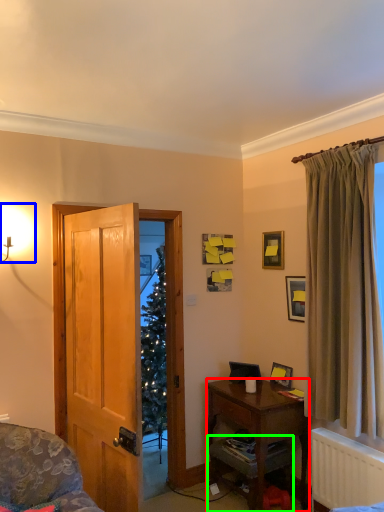
Question: Which is farther away from desk (highlighted by a red box)? light fixture (highlighted by a blue box) or cabinetry (highlighted by a green box)?

Choices:
 (A) light fixture
 (B) cabinetry

Answer: (A)